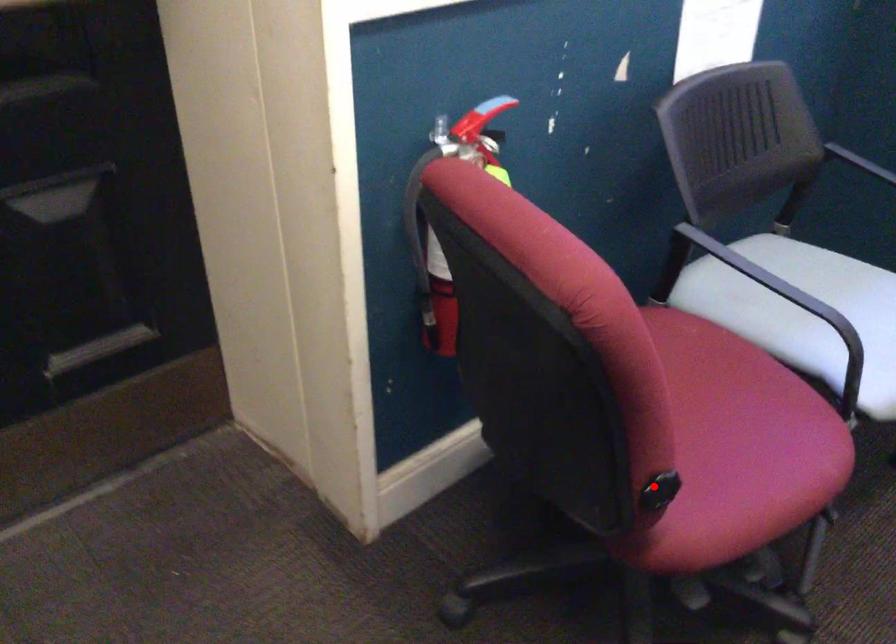
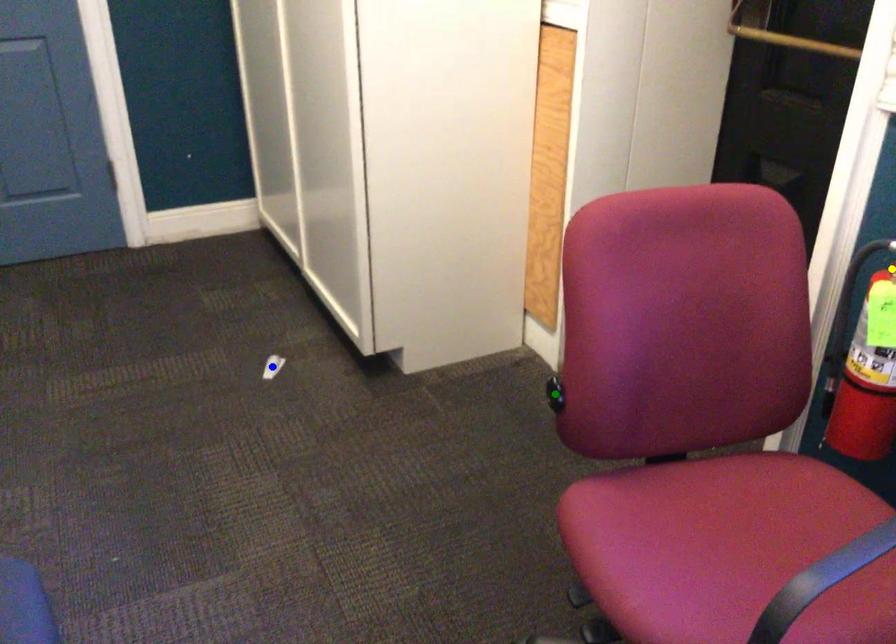
Question: I am providing you with two images of the same scene from different viewpoints. A red point is marked on the first image. You are given multiple points on the second image. Which point in image 2 is actually the same real-world point as the red point in image 1?

Choices:
 (A) blue point
 (B) yellow point
 (C) green point

Answer: (C)